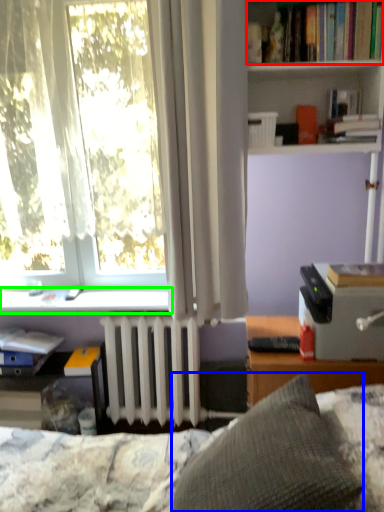
Question: Which is farther away from book (highlighted by a red box)? pillow (highlighted by a blue box) or window sill (highlighted by a green box)?

Choices:
 (A) pillow
 (B) window sill

Answer: (A)